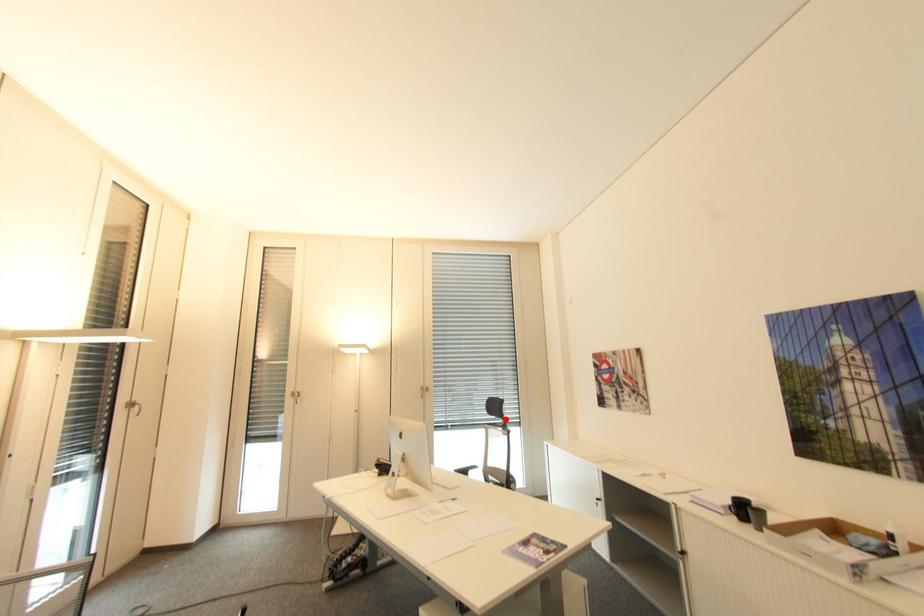
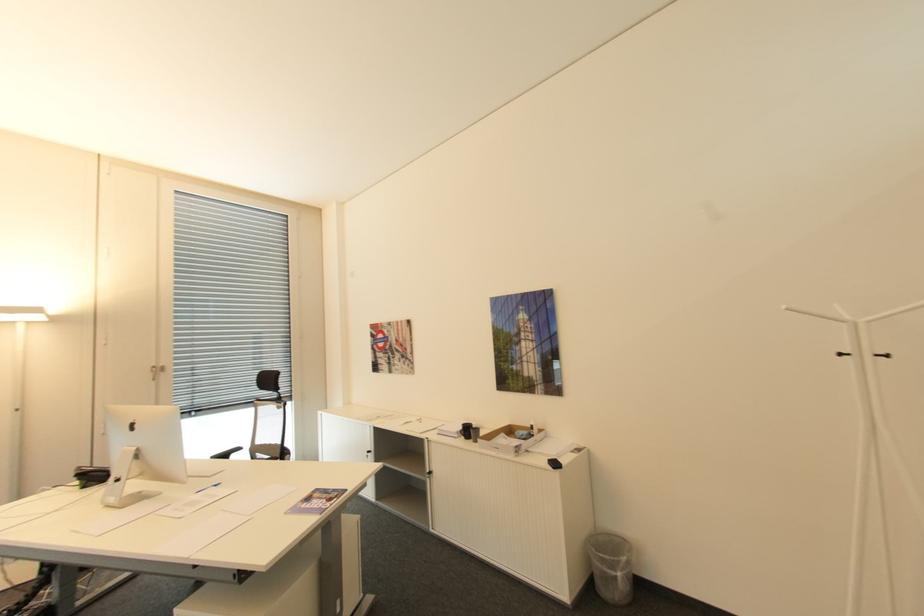
Question: I am providing you with two images of the same scene from different viewpoints. In image1, a red point is highlighted. Considering the same 3D point in image2, which of the following is correct?

Choices:
 (A) It is closer
 (B) It is farther

Answer: (A)